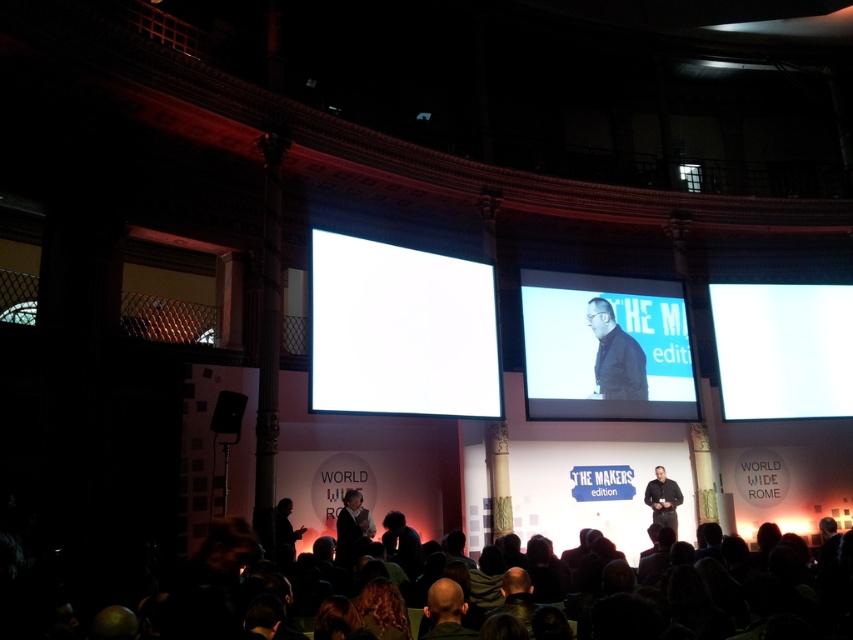
Who is shorter, dark brown hair at lower center or dark brown leather jacket at center?

Standing shorter between the two is dark brown hair at lower center.

Which is behind, point (180, 628) or point (593, 323)?

Positioned behind is point (593, 323).

The height and width of the screenshot is (640, 853). What are the coordinates of `dark brown hair at lower center` in the screenshot? It's located at (210, 584).

Is white glossy projection screen at right taller than dark gray suit at lower left?

Yes.

Which is in front, point (788, 288) or point (350, 531)?

Point (350, 531) is more forward.

Does point (741, 305) come closer to viewer compared to point (370, 536)?

No, (741, 305) is behind (370, 536).

You are a GUI agent. You are given a task and a screenshot of the screen. Output one action in this format:
    pyautogui.click(x=<x>, y=<y>)
    Task: Click on the white glossy projection screen at right
    
    Given the screenshot: What is the action you would take?
    pyautogui.click(x=782, y=349)

Can you confirm if dark gray suit at lower left is positioned below black matte suit at center?

Incorrect, dark gray suit at lower left is not positioned below black matte suit at center.

Which is in front, point (347, 516) or point (663, 483)?

Positioned in front is point (347, 516).

Identify the location of dark gray suit at lower left. (349, 528).